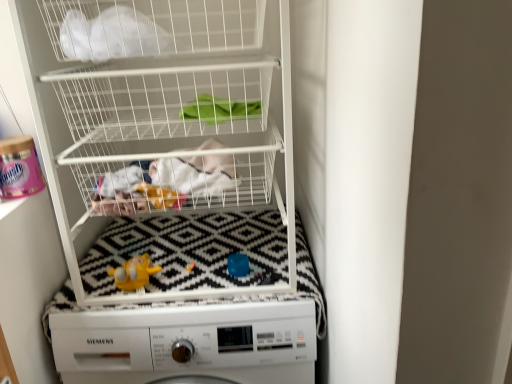
Image resolution: width=512 pixels, height=384 pixels. I want to click on vacant position to the left of yellow rubber duck at center, so click(85, 285).